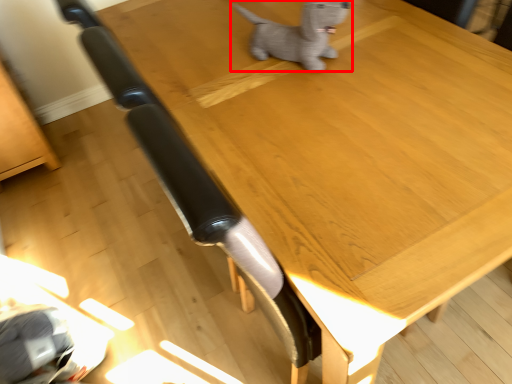
Question: From the image's perspective, what is the correct spatial relationship of dog (annotated by the red box) in relation to furniture?

Choices:
 (A) below
 (B) above

Answer: (B)